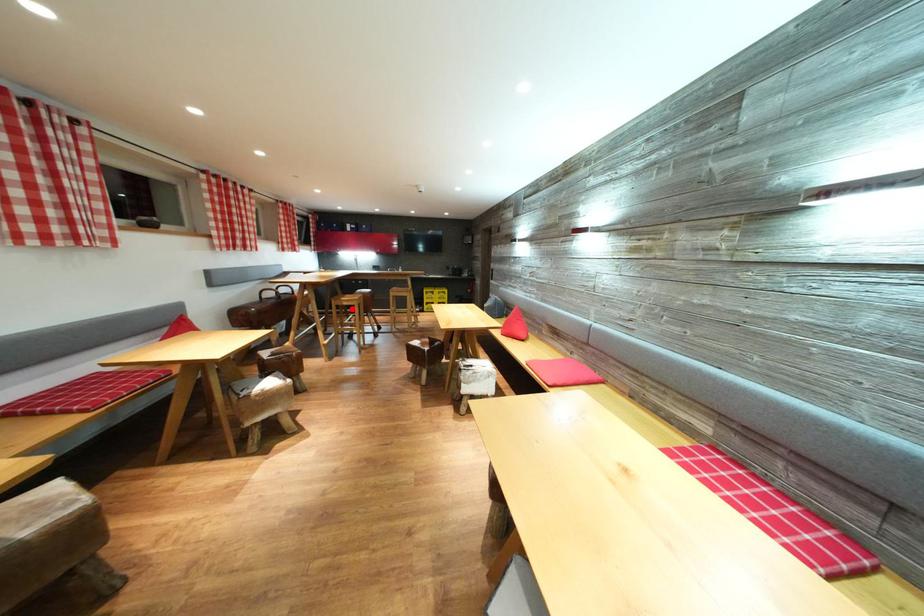
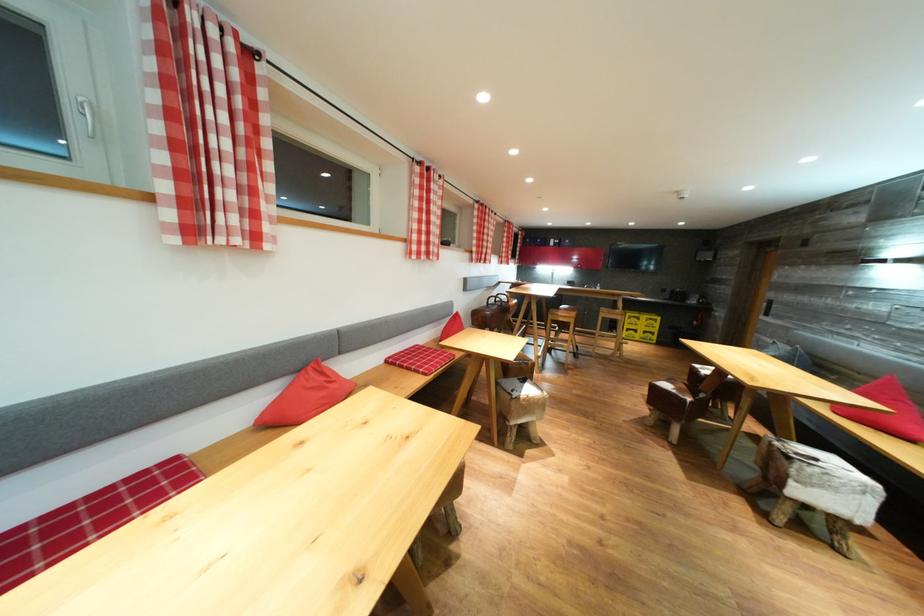
Find the pixel in the second image that matches the highlighted location in the first image.

(567, 325)